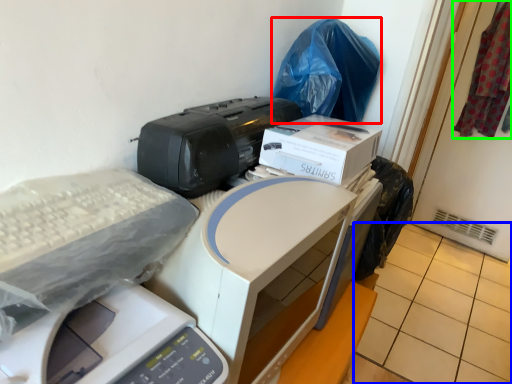
Question: Considering the real-world distances, which object is closest to garbage (highlighted by a red box)? tile (highlighted by a blue box) or material (highlighted by a green box).

Choices:
 (A) tile
 (B) material

Answer: (A)